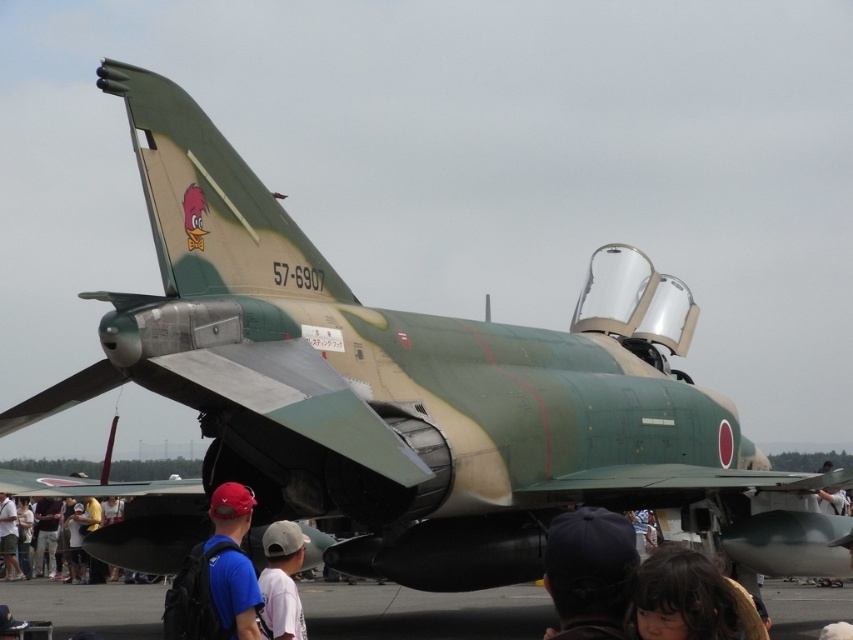
Is matte blue shirt at center above dark brown hair at lower center?

Incorrect, matte blue shirt at center is not positioned above dark brown hair at lower center.

Measure the distance between point (223, 552) and camera.

Point (223, 552) is 11.67 meters away from camera.

This screenshot has height=640, width=853. I want to click on matte blue shirt at center, so click(x=218, y=577).

Describe the element at coordinates (590, 572) in the screenshot. The width and height of the screenshot is (853, 640). I see `dark blue fabric cap at lower center` at that location.

Who is lower down, dark blue fabric cap at lower center or white matte cap at center?

Positioned lower is white matte cap at center.

Locate an element on the screen. The height and width of the screenshot is (640, 853). dark blue fabric cap at lower center is located at coordinates (590, 572).

The image size is (853, 640). What are the coordinates of `dark blue fabric cap at lower center` in the screenshot? It's located at (590, 572).

Which is below, dark brown hair at lower center or blue t-shirt at lower left?

Positioned lower is blue t-shirt at lower left.

Which is more to the right, dark brown hair at lower center or blue t-shirt at lower left?

From the viewer's perspective, dark brown hair at lower center appears more on the right side.

This screenshot has height=640, width=853. I want to click on dark brown hair at lower center, so click(x=692, y=600).